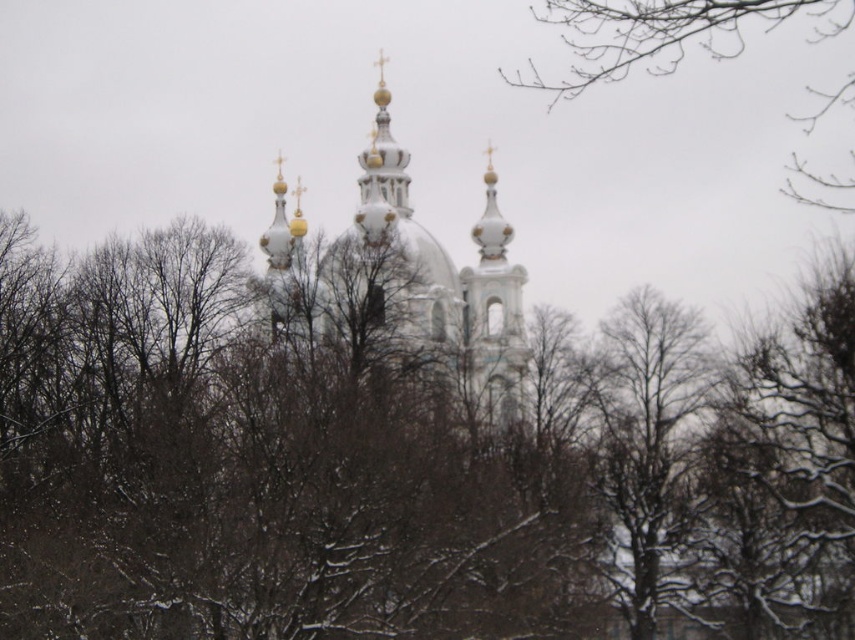
Can you confirm if white marble church at center is shorter than bare branches at upper right?

No.

Is white marble church at center to the left of bare branches at upper right from the viewer's perspective?

Correct, you'll find white marble church at center to the left of bare branches at upper right.

The image size is (855, 640). Identify the location of white marble church at center. (410, 275).

Does point (437, 593) come farther from viewer compared to point (358, 208)?

No, it is in front of (358, 208).

Image resolution: width=855 pixels, height=640 pixels. I want to click on brown textured tree at center, so click(x=401, y=460).

Who is lower down, brown textured tree at center or bare branches at upper right?

brown textured tree at center is lower down.

Does brown textured tree at center have a lesser width compared to bare branches at upper right?

No, brown textured tree at center is not thinner than bare branches at upper right.

Is point (839, 323) less distant than point (565, 38)?

Yes, point (839, 323) is in front of point (565, 38).

I want to click on brown textured tree at center, so click(x=401, y=460).